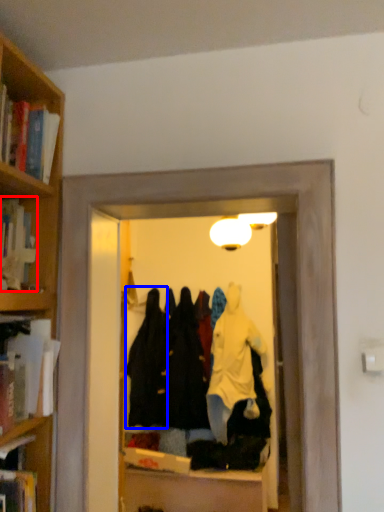
Question: Which object appears closest to the camera in this image, book (highlighted by a red box) or clothing (highlighted by a blue box)?

Choices:
 (A) book
 (B) clothing

Answer: (A)